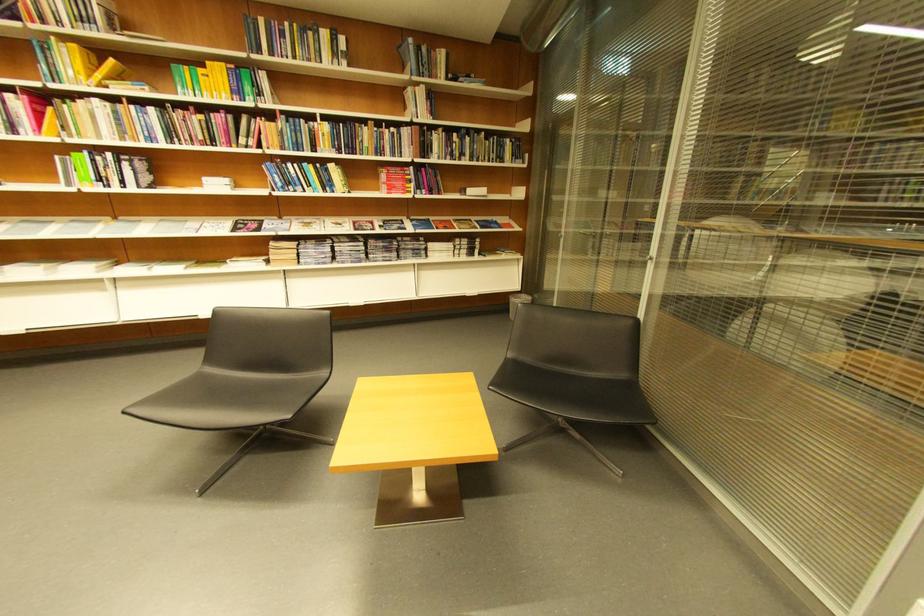
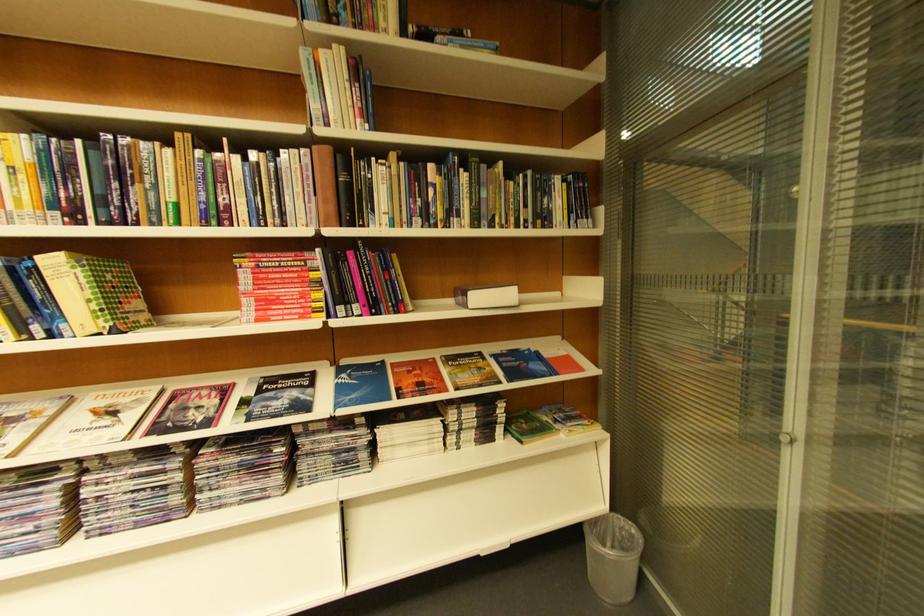
In the second image, find the point that corresponds to the point at 342,168 in the first image.

(63, 264)